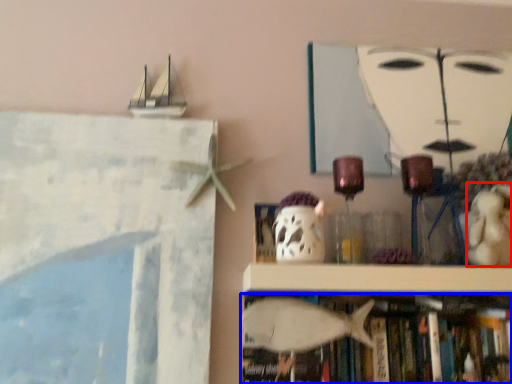
Question: Which of the following is the farthest to the observer, toy (highlighted by a red box) or book (highlighted by a blue box)?

Choices:
 (A) toy
 (B) book

Answer: (B)